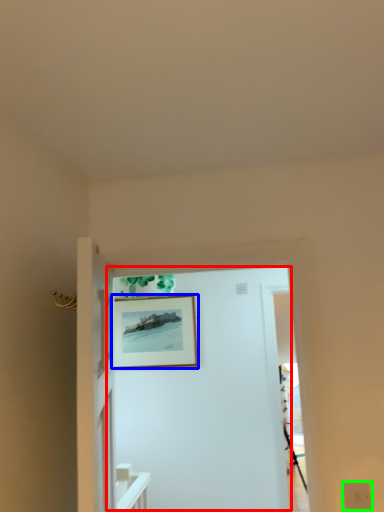
Question: Which object is positioned farthest from door (highlighted by a red box)? Select from picture frame (highlighted by a blue box) and electric outlet (highlighted by a green box).

Choices:
 (A) picture frame
 (B) electric outlet

Answer: (B)